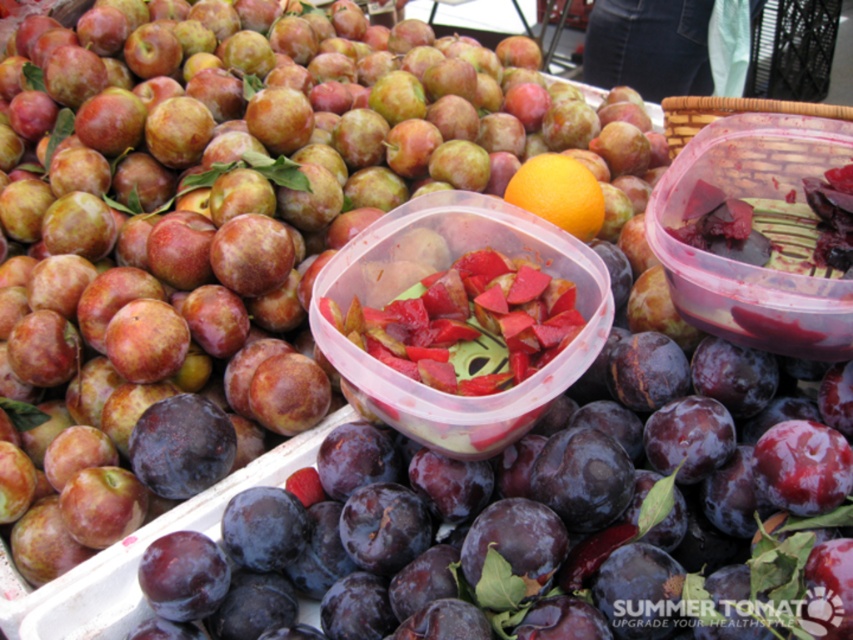
Consider the image. You are a fruit vendor who wants to arrange fruits in a display. You have a shiny red apple at upper left and an orange matte at center. Which fruit should you place in a position where size matters more for visibility?

The shiny red apple at upper left should be placed in the position where size matters more for visibility since it is larger than the orange matte at center.